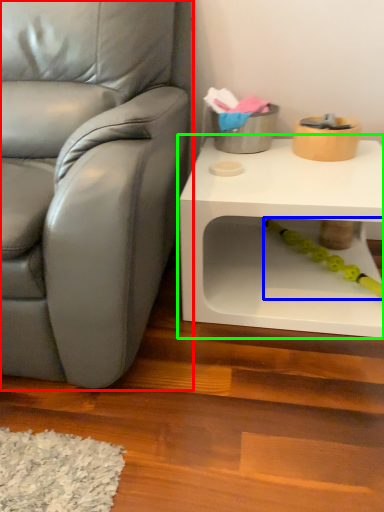
Question: Estimate the real-world distances between objects in this image. Which object is farther from chair (highlighted by a red box), toy (highlighted by a blue box) or table (highlighted by a green box)?

Choices:
 (A) toy
 (B) table

Answer: (A)